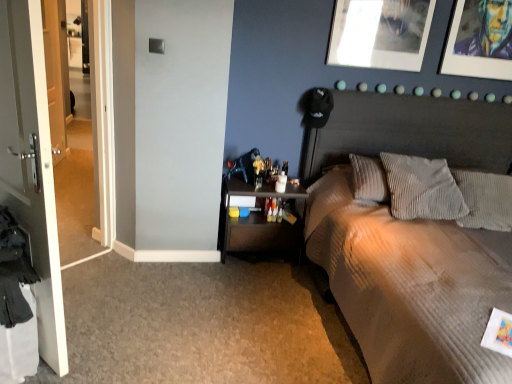
Question: Are metallic silver picture frame at upper right, which is the second picture frame in left-to-right order, and white corduroy pillow at center, which is the 1th pillow from left to right, making contact?

Choices:
 (A) yes
 (B) no

Answer: (B)

Question: Is metallic silver picture frame at upper right, which is the 1th picture frame in right-to-left order, at the right side of white corduroy pillow at center, the 2th pillow when ordered from right to left?

Choices:
 (A) no
 (B) yes

Answer: (B)

Question: From the image's perspective, is metallic silver picture frame at upper right, which is the 1th picture frame in right-to-left order, under white corduroy pillow at center, the 2th pillow when ordered from right to left?

Choices:
 (A) no
 (B) yes

Answer: (A)

Question: Does metallic silver picture frame at upper right, which is the second picture frame in left-to-right order, have a greater width compared to white corduroy pillow at center, which is the 1th pillow from left to right?

Choices:
 (A) no
 (B) yes

Answer: (A)

Question: Considering the relative sizes of metallic silver picture frame at upper right, which is the 1th picture frame in right-to-left order, and white corduroy pillow at center, the 2th pillow when ordered from right to left, in the image provided, is metallic silver picture frame at upper right, which is the 1th picture frame in right-to-left order, taller than white corduroy pillow at center, the 2th pillow when ordered from right to left,?

Choices:
 (A) yes
 (B) no

Answer: (A)

Question: Could you tell me if metallic silver picture frame at upper right, which is the 1th picture frame in right-to-left order, is turned towards white corduroy pillow at center, which is the 1th pillow from left to right?

Choices:
 (A) yes
 (B) no

Answer: (B)

Question: Considering the relative positions of metallic silver picture frame at upper center, acting as the second picture frame starting from the right, and metallic silver picture frame at upper right, which is the second picture frame in left-to-right order, in the image provided, is metallic silver picture frame at upper center, acting as the second picture frame starting from the right, behind metallic silver picture frame at upper right, which is the second picture frame in left-to-right order,?

Choices:
 (A) no
 (B) yes

Answer: (A)

Question: From the image's perspective, is metallic silver picture frame at upper center, which appears as the first picture frame when viewed from the left, on top of metallic silver picture frame at upper right, which is the second picture frame in left-to-right order?

Choices:
 (A) yes
 (B) no

Answer: (A)

Question: Is metallic silver picture frame at upper center, which appears as the first picture frame when viewed from the left, positioned in front of metallic silver picture frame at upper right, which is the second picture frame in left-to-right order?

Choices:
 (A) yes
 (B) no

Answer: (A)

Question: From a real-world perspective, is metallic silver picture frame at upper center, acting as the second picture frame starting from the right, physically below metallic silver picture frame at upper right, which is the 1th picture frame in right-to-left order?

Choices:
 (A) no
 (B) yes

Answer: (B)

Question: Considering the relative sizes of metallic silver picture frame at upper center, acting as the second picture frame starting from the right, and metallic silver picture frame at upper right, which is the 1th picture frame in right-to-left order, in the image provided, is metallic silver picture frame at upper center, acting as the second picture frame starting from the right, smaller than metallic silver picture frame at upper right, which is the 1th picture frame in right-to-left order,?

Choices:
 (A) no
 (B) yes

Answer: (B)

Question: Can you confirm if metallic silver picture frame at upper center, acting as the second picture frame starting from the right, is wider than metallic silver picture frame at upper right, which is the second picture frame in left-to-right order?

Choices:
 (A) no
 (B) yes

Answer: (A)

Question: Is textured beige bed at upper right thinner than gray corduroy pillow at right, the 1th pillow from the right?

Choices:
 (A) yes
 (B) no

Answer: (B)